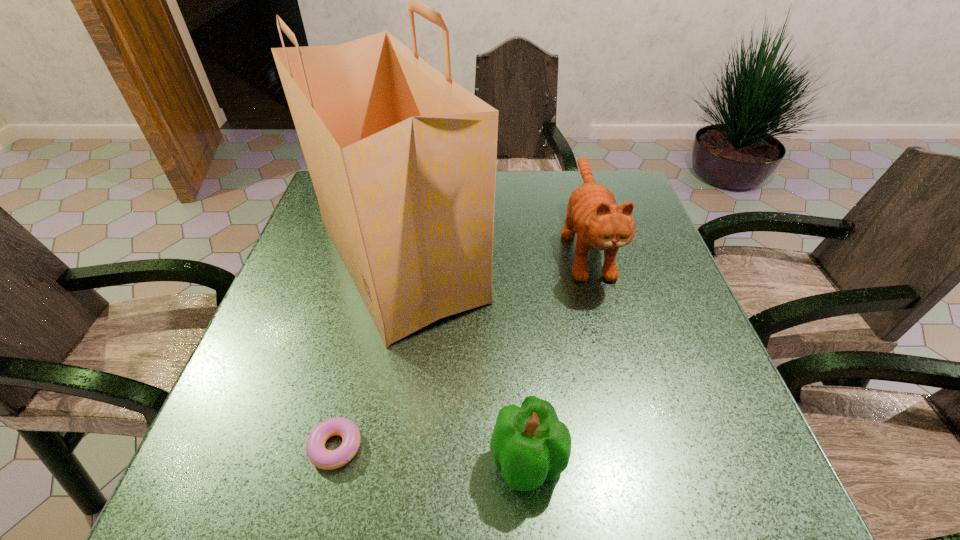
This screenshot has width=960, height=540. I want to click on the tallest object, so click(403, 159).

Where is `the third shortest object`? The image size is (960, 540). the third shortest object is located at coordinates (592, 213).

Identify the location of cat. The height and width of the screenshot is (540, 960). pyautogui.click(x=592, y=213).

Where is `the second shortest object`? The image size is (960, 540). the second shortest object is located at coordinates (530, 444).

You are a GUI agent. You are given a task and a screenshot of the screen. Output one action in this format:
    pyautogui.click(x=<x>, y=<y>)
    Task: Click on the shortest object
    The width and height of the screenshot is (960, 540).
    Given the screenshot: What is the action you would take?
    pyautogui.click(x=319, y=456)

I want to click on vacant region located 0.050m on the side of the grocery bag with the superhero design, so point(512,259).

Identify the location of vacant space located 0.380m on the face of the rightmost object. (646, 469).

In order to click on vacant space situated 0.060m on the back of the bell pepper in this screenshot , I will do `click(522, 396)`.

This screenshot has height=540, width=960. What are the coordinates of `vacant area situated 0.380m on the back of the doughnut` in the screenshot? It's located at (377, 274).

This screenshot has height=540, width=960. In order to click on grocery bag present at the far edge in this screenshot , I will do `click(403, 159)`.